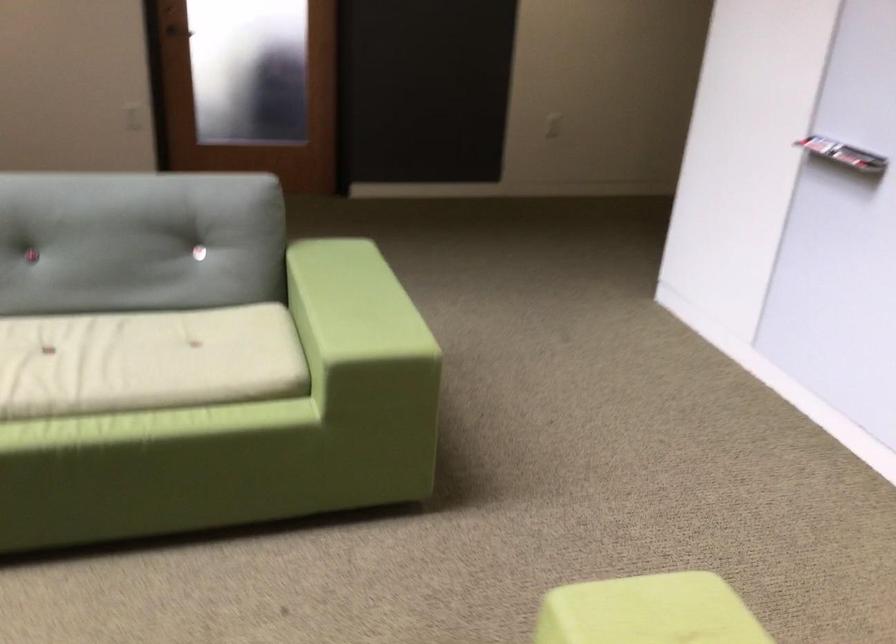
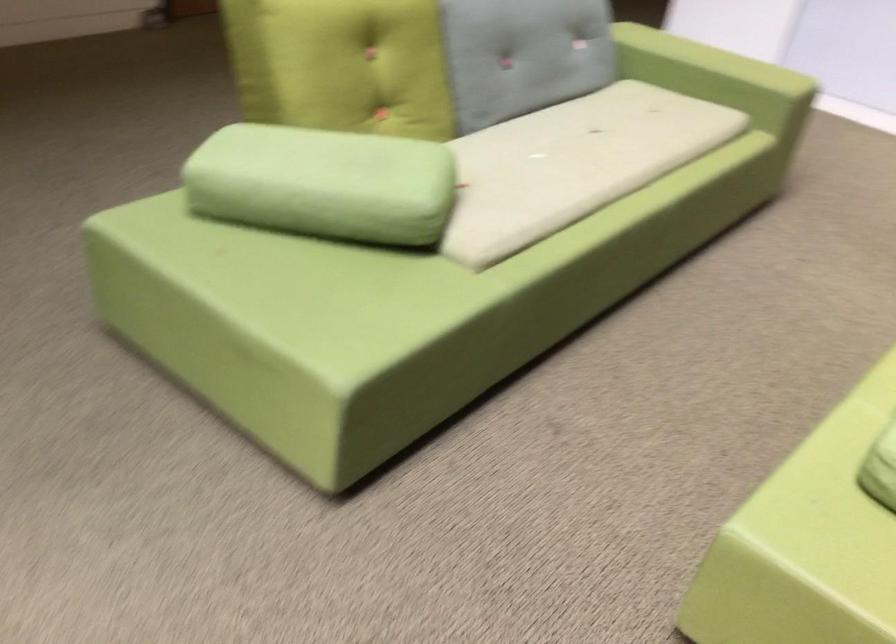
The point at (x=286, y=326) is marked in the first image. Where is the corresponding point in the second image?

(717, 77)